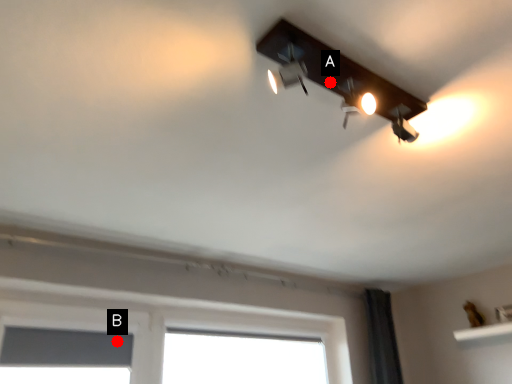
Question: Two points are circled on the image, labeled by A and B beside each circle. Which of the following is the farthest from the observer?

Choices:
 (A) A is further
 (B) B is further

Answer: (B)